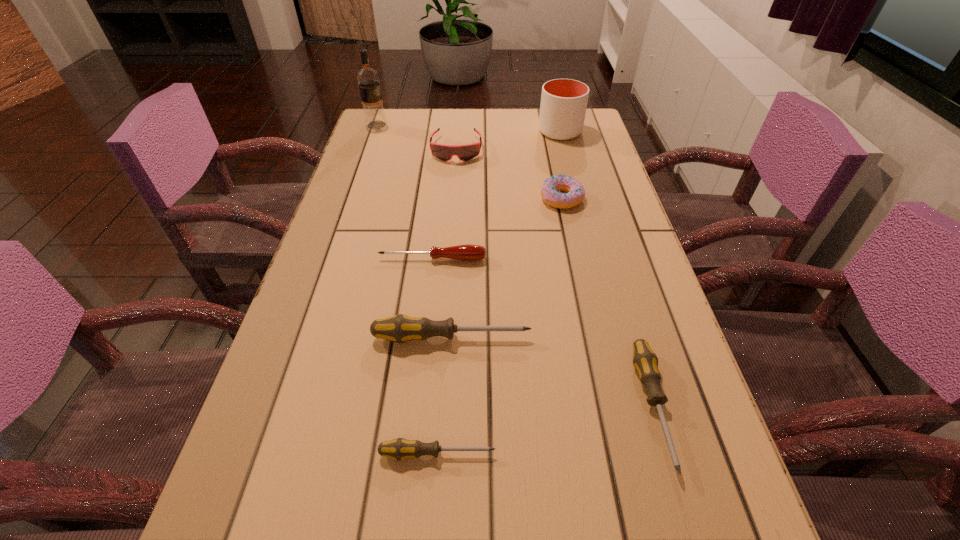
Image resolution: width=960 pixels, height=540 pixels. In order to click on free spot between the goggles and the tallest object in this screenshot , I will do `click(417, 137)`.

Identify the location of object that is the fourth nearest to the goggles. This screenshot has width=960, height=540. click(469, 252).

Identify which object is located as the second nearest to the fifth farthest object. Please provide its 2D coordinates. Your answer should be formatted as a tuple, i.e. [(x, y)], where the tuple contains the x and y coordinates of a point satisfying the conditions above.

[(550, 191)]

Find the location of a particular element. This screenshot has width=960, height=540. screwdriver that is the closest to the white cup is located at coordinates (469, 252).

Identify which screwdriver is the closest to the pink goggles. Please provide its 2D coordinates. Your answer should be formatted as a tuple, i.e. [(x, y)], where the tuple contains the x and y coordinates of a point satisfying the conditions above.

[(469, 252)]

The height and width of the screenshot is (540, 960). Find the location of `gray screwdriver identified as the second closest to the goggles`. gray screwdriver identified as the second closest to the goggles is located at coordinates (645, 361).

Identify which gray screwdriver is the second nearest to the shortest screwdriver. Please provide its 2D coordinates. Your answer should be formatted as a tuple, i.e. [(x, y)], where the tuple contains the x and y coordinates of a point satisfying the conditions above.

[(645, 361)]

At what (x,y) coordinates should I click in order to perform the action: click on vacant area in the image that satisfies the following two spatial constraints: 1. on the back side of the purple doughnut; 2. on the label of the vodka. Please return your answer as a coordinate pair (x, y). The height and width of the screenshot is (540, 960). Looking at the image, I should click on (546, 125).

At what (x,y) coordinates should I click in order to perform the action: click on free region that satisfies the following two spatial constraints: 1. on the back side of the doughnut; 2. on the label of the leftmost object. Please return your answer as a coordinate pair (x, y). Image resolution: width=960 pixels, height=540 pixels. Looking at the image, I should click on (546, 125).

The height and width of the screenshot is (540, 960). Identify the location of vacant position in the image that satisfies the following two spatial constraints: 1. on the front-facing side of the goggles; 2. on the right side of the doughnut. (452, 198).